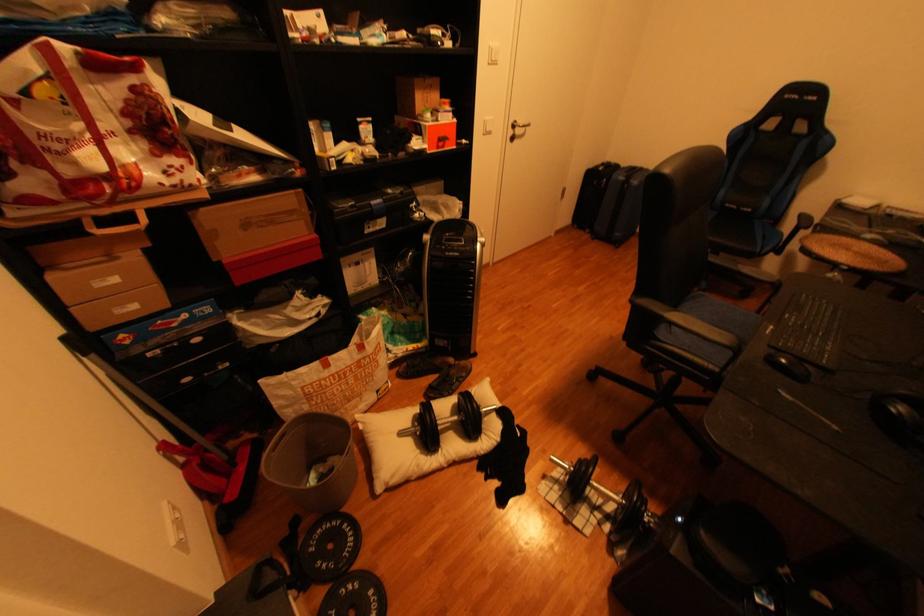
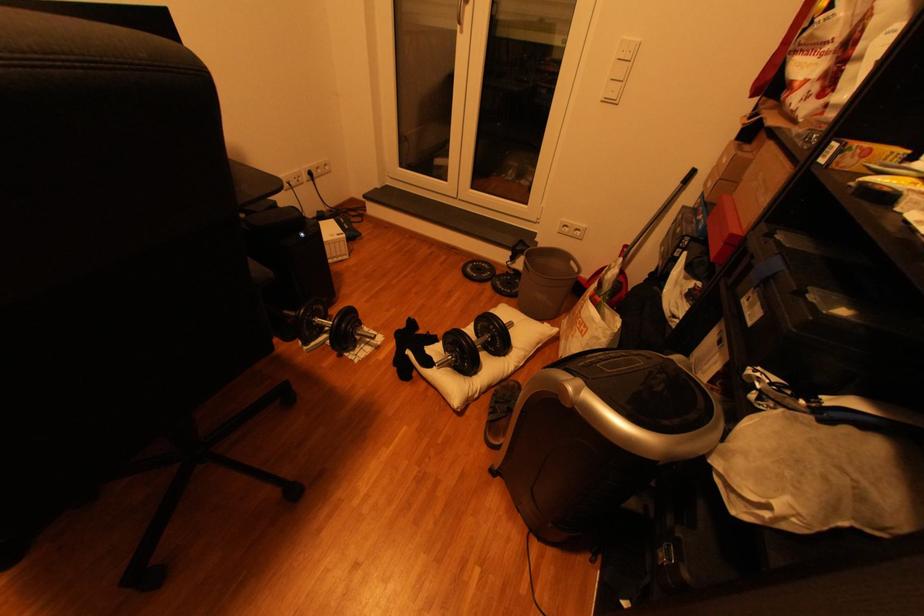
Locate, in the second image, the point that corresponds to pixel 354 527 in the first image.

(518, 292)